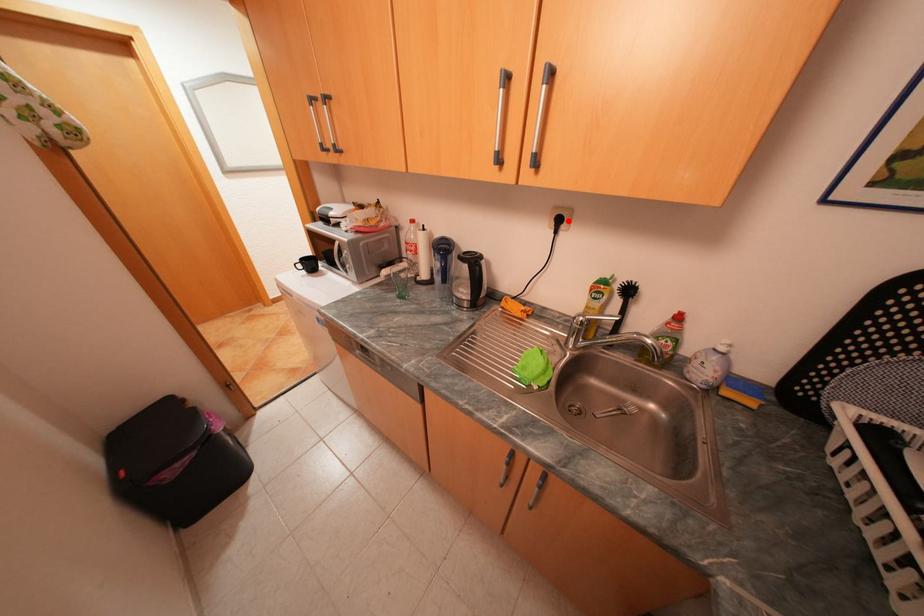
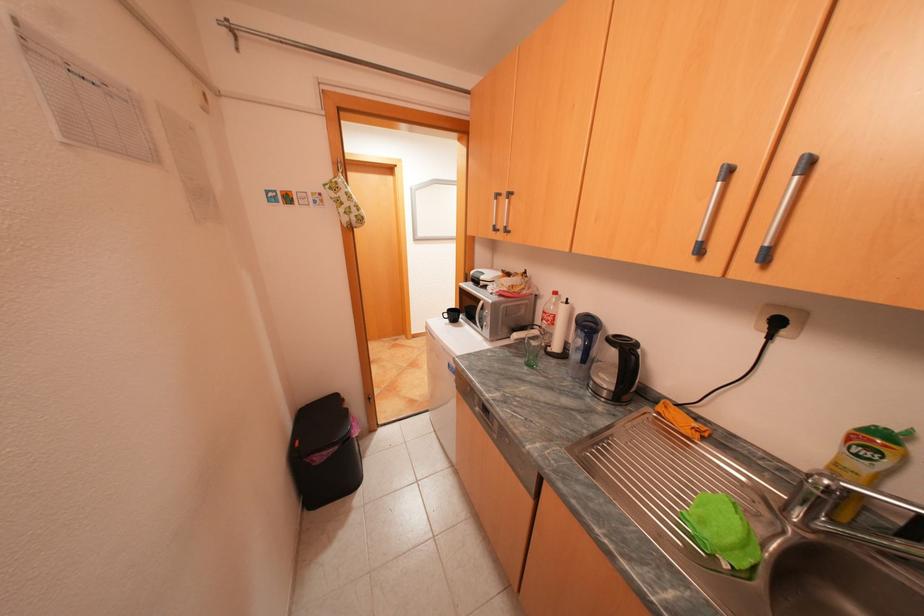
Find the pixel in the second image that matches the highlighted location in the first image.

(786, 323)